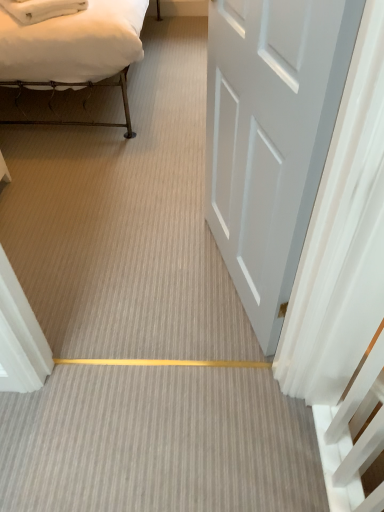
The image size is (384, 512). What do you see at coordinates (271, 137) in the screenshot?
I see `white glossy door at center` at bounding box center [271, 137].

The width and height of the screenshot is (384, 512). In order to click on white glossy door at center in this screenshot , I will do `click(271, 137)`.

Describe the element at coordinates (73, 51) in the screenshot. I see `white cotton bed at upper left` at that location.

The height and width of the screenshot is (512, 384). What are the coordinates of `white cotton bed at upper left` in the screenshot? It's located at (73, 51).

Locate an element on the screen. white glossy door at center is located at coordinates (271, 137).

Between white glossy door at center and white cotton bed at upper left, which one appears on the right side from the viewer's perspective?

From the viewer's perspective, white glossy door at center appears more on the right side.

Which object is further away from the camera taking this photo, white glossy door at center or white cotton bed at upper left?

Positioned behind is white cotton bed at upper left.

Does point (208, 37) appear closer or farther from the camera than point (139, 7)?

Clearly, point (208, 37) is closer to the camera than point (139, 7).

From the image's perspective, which is below, white glossy door at center or white cotton bed at upper left?

white glossy door at center, from the image's perspective.

From a real-world perspective, is white glossy door at center on top of white cotton bed at upper left?

Yes, from a real-world perspective, white glossy door at center is on top of white cotton bed at upper left.

Is white glossy door at center wider or thinner than white cotton bed at upper left?

Considering their sizes, white glossy door at center looks slimmer than white cotton bed at upper left.

In terms of height, does white glossy door at center look taller or shorter compared to white cotton bed at upper left?

In the image, white glossy door at center appears to be taller than white cotton bed at upper left.

In terms of size, does white glossy door at center appear bigger or smaller than white cotton bed at upper left?

Considering their sizes, white glossy door at center takes up less space than white cotton bed at upper left.

Is white glossy door at center spatially inside white cotton bed at upper left, or outside of it?

white glossy door at center is spatially situated outside white cotton bed at upper left.

Are white glossy door at center and white cotton bed at upper left making contact?

white glossy door at center and white cotton bed at upper left are clearly separated.

Is white glossy door at center positioned with its back to white cotton bed at upper left?

No, white glossy door at center is not facing the opposite direction of white cotton bed at upper left.

Measure the distance between white glossy door at center and white cotton bed at upper left.

A distance of 4.09 feet exists between white glossy door at center and white cotton bed at upper left.

At what (x,y) coordinates should I click in order to perform the action: click on door below the white cotton bed at upper left (from the image's perspective). Please return your answer as a coordinate pair (x, y). The height and width of the screenshot is (512, 384). Looking at the image, I should click on (271, 137).

Is white cotton bed at upper left to the right of white glossy door at center from the viewer's perspective?

In fact, white cotton bed at upper left is to the left of white glossy door at center.

Is white cotton bed at upper left behind white glossy door at center?

Yes, it is behind white glossy door at center.

Is point (34, 88) positioned after point (269, 167)?

Yes, point (34, 88) is behind point (269, 167).

From the image's perspective, is white cotton bed at upper left above or below white glossy door at center?

Based on their image positions, white cotton bed at upper left is located above white glossy door at center.

From a real-world perspective, relative to white glossy door at center, is white cotton bed at upper left vertically above or below?

Clearly, from a real-world perspective, white cotton bed at upper left is below white glossy door at center.

Between white cotton bed at upper left and white glossy door at center, which one has larger width?

With larger width is white cotton bed at upper left.

Does white cotton bed at upper left have a greater height compared to white glossy door at center?

No.

In terms of size, does white cotton bed at upper left appear bigger or smaller than white glossy door at center?

In the image, white cotton bed at upper left appears to be larger than white glossy door at center.

Do you think white cotton bed at upper left is within white glossy door at center, or outside of it?

white cotton bed at upper left exists outside the volume of white glossy door at center.

Are white cotton bed at upper left and white glossy door at center far apart?

Indeed, white cotton bed at upper left is not near white glossy door at center.

From the picture: Does white cotton bed at upper left turn towards white glossy door at center?

Yes, white cotton bed at upper left is aimed at white glossy door at center.

What's the angular difference between white cotton bed at upper left and white glossy door at center's facing directions?

73.6 degrees separate the facing orientations of white cotton bed at upper left and white glossy door at center.

Measure the distance from white cotton bed at upper left to white glossy door at center.

white cotton bed at upper left and white glossy door at center are 1.25 meters apart.

The height and width of the screenshot is (512, 384). I want to click on bed above the white glossy door at center (from the image's perspective), so click(73, 51).

I want to click on door in front of the white cotton bed at upper left, so click(271, 137).

You are a GUI agent. You are given a task and a screenshot of the screen. Output one action in this format:
    pyautogui.click(x=<x>, y=<y>)
    Task: Click on the bed lying above the white glossy door at center (from the image's perspective)
    Image resolution: width=384 pixels, height=512 pixels.
    Given the screenshot: What is the action you would take?
    pyautogui.click(x=73, y=51)